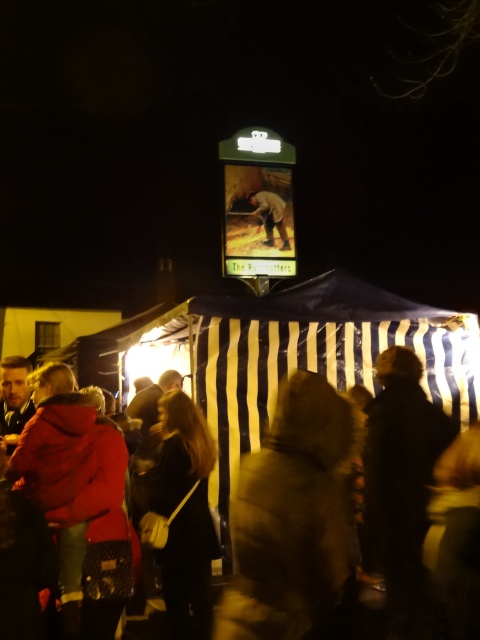
Question: Among these objects, which one is farthest from the camera?

Choices:
 (A) dark brown leather jacket at lower center
 (B) red fleece jacket at left

Answer: (A)

Question: Which of the following is the closest to the observer?

Choices:
 (A) (47, 454)
 (B) (255, 564)

Answer: (B)

Question: Can you confirm if red fleece jacket at left is thinner than dark brown leather jacket at center?

Choices:
 (A) no
 (B) yes

Answer: (A)

Question: Is the position of brown fur coat at center less distant than that of dark brown leather jacket at center?

Choices:
 (A) no
 (B) yes

Answer: (B)

Question: Which point is farther to the camera?

Choices:
 (A) red fleece jacket at left
 (B) brown fur coat at center
 (C) dark brown leather jacket at center
 (D) brown leather jacket at center

Answer: (D)

Question: From the image, what is the correct spatial relationship of dark brown leather jacket at lower center in relation to dark brown leather jacket at center?

Choices:
 (A) above
 (B) below

Answer: (A)